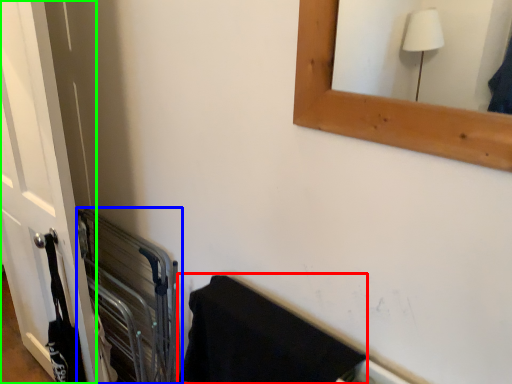
Question: Considering the real-world distances, which object is farthest from bath towel (highlighted by a red box)? balustrade (highlighted by a blue box) or door (highlighted by a green box)?

Choices:
 (A) balustrade
 (B) door

Answer: (B)